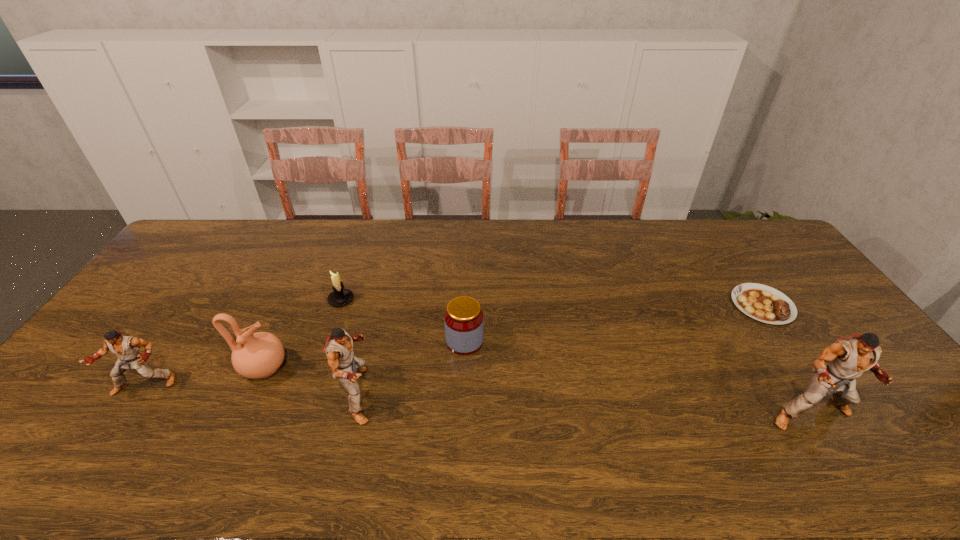
What are the coordinates of `vacant area that lies between the rightmost puncher and the second shortest puncher` in the screenshot? It's located at (585, 404).

You are a GUI agent. You are given a task and a screenshot of the screen. Output one action in this format:
    pyautogui.click(x=<x>, y=<y>)
    Task: Click on the free spot between the steak and the second tallest puncher
    
    Given the screenshot: What is the action you would take?
    pyautogui.click(x=561, y=350)

Point out which object is positioned as the fifth nearest to the rightmost puncher. Please provide its 2D coordinates. Your answer should be formatted as a tuple, i.e. [(x, y)], where the tuple contains the x and y coordinates of a point satisfying the conditions above.

[(256, 355)]

Identify which object is located as the third nearest to the third object from right to left. Please provide its 2D coordinates. Your answer should be formatted as a tuple, i.e. [(x, y)], where the tuple contains the x and y coordinates of a point satisfying the conditions above.

[(256, 355)]

Select which puncher is the third closest to the fifth object from right to left. Please provide its 2D coordinates. Your answer should be formatted as a tuple, i.e. [(x, y)], where the tuple contains the x and y coordinates of a point satisfying the conditions above.

[(848, 358)]

Select which puncher is the closest to the rightmost puncher. Please provide its 2D coordinates. Your answer should be formatted as a tuple, i.e. [(x, y)], where the tuple contains the x and y coordinates of a point satisfying the conditions above.

[(339, 345)]